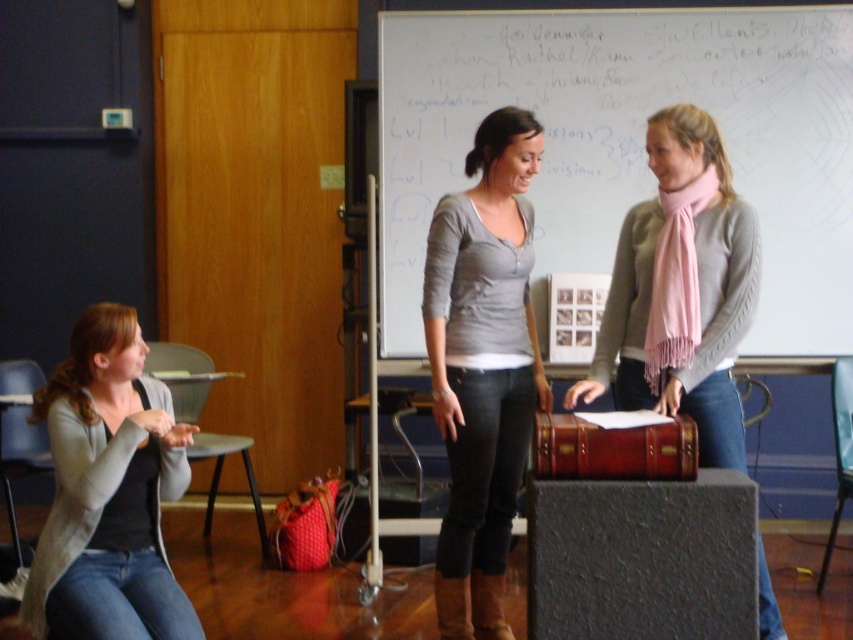
You are standing in the classroom and want to move from the whiteboard at upper center to the light gray sweater at center. Which direction should you move?

You should move to the right because the whiteboard at upper center is to the left of the light gray sweater at center.

You are a student entering the classroom and see the whiteboard at upper center and the matte gray cardigan at lower left. Which object is positioned higher in the image?

The whiteboard at upper center is positioned higher than the matte gray cardigan at lower left.